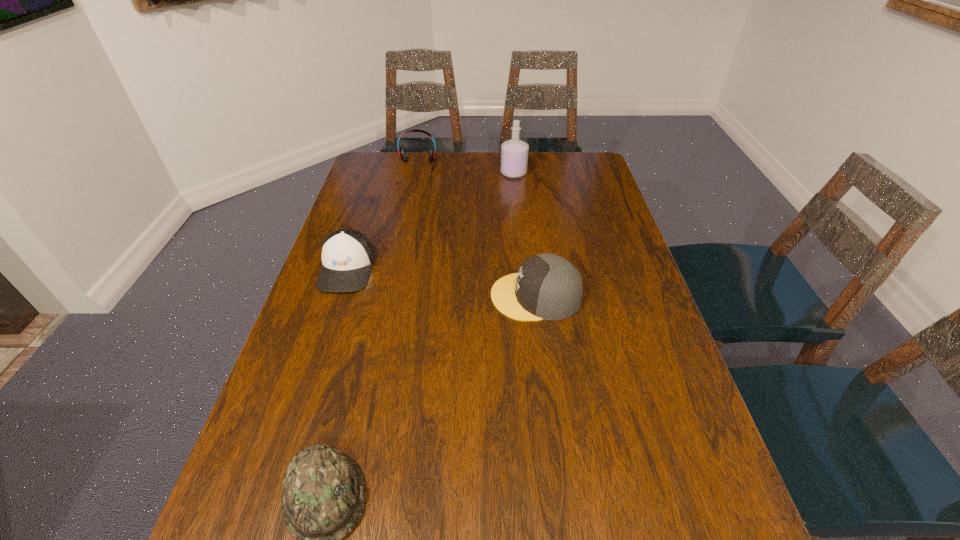
This screenshot has height=540, width=960. What are the coordinates of `perfume` in the screenshot? It's located at (514, 153).

Where is `headset`? This screenshot has width=960, height=540. headset is located at coordinates pos(403,155).

Where is `the rightmost headwear`? Image resolution: width=960 pixels, height=540 pixels. the rightmost headwear is located at coordinates (548, 287).

Locate an element on the screen. The image size is (960, 540). blank area located on the front of the tallest object is located at coordinates (519, 222).

Find the location of a particular element. The width and height of the screenshot is (960, 540). free region located with the microphone attached to the side of the headset is located at coordinates (407, 217).

Where is `free space located on the front-facing side of the rightmost headwear`? The image size is (960, 540). free space located on the front-facing side of the rightmost headwear is located at coordinates (472, 296).

I want to click on free space located on the front-facing side of the rightmost headwear, so pyautogui.click(x=396, y=296).

The height and width of the screenshot is (540, 960). I want to click on free space located 0.260m on the front-facing side of the rightmost headwear, so click(392, 296).

Find the location of a particular element. perfume located at the far edge is located at coordinates (514, 153).

Where is `headset positioned at the far edge`? The width and height of the screenshot is (960, 540). headset positioned at the far edge is located at coordinates (403, 155).